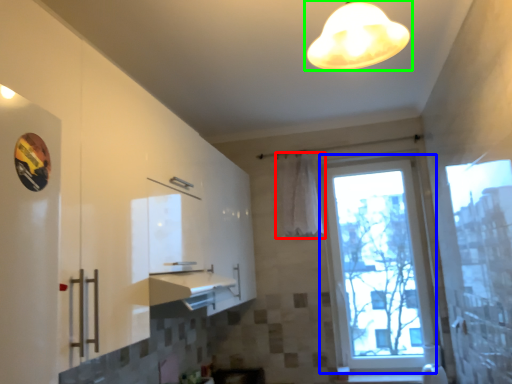
Question: Which object is positioned farthest from curtain (highlighted by a red box)? Select from window (highlighted by a blue box) and lamp (highlighted by a green box).

Choices:
 (A) window
 (B) lamp

Answer: (B)